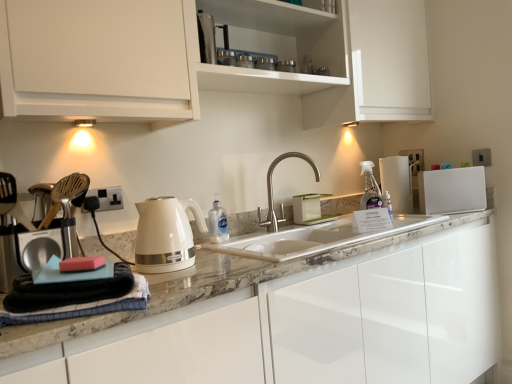
This screenshot has height=384, width=512. Describe the element at coordinates (452, 190) in the screenshot. I see `white glossy refrigerator at right` at that location.

Image resolution: width=512 pixels, height=384 pixels. Describe the element at coordinates (316, 238) in the screenshot. I see `white marble sink at center` at that location.

Image resolution: width=512 pixels, height=384 pixels. I want to click on white glossy electric kettle at center-left, so click(x=166, y=234).

The width and height of the screenshot is (512, 384). I want to click on white glossy refrigerator at right, so click(452, 190).

From the image's perspective, which object appears higher, white plastic electric outlet at upper right, placed as the first electric outlet when sorted from top to bottom, or glossy white cabinet at center, the 2th cabinetry in the top-to-bottom sequence?

From the image's view, white plastic electric outlet at upper right, placed as the first electric outlet when sorted from top to bottom, is above.

Between white plastic electric outlet at upper right, the 2th electric outlet when ordered from bottom to top, and glossy white cabinet at center, the 2th cabinetry in the top-to-bottom sequence, which one has less height?

Standing shorter between the two is white plastic electric outlet at upper right, the 2th electric outlet when ordered from bottom to top.

Considering the relative positions of white plastic electric outlet at upper right, the 2th electric outlet when ordered from bottom to top, and glossy white cabinet at center, the 2th cabinetry in the top-to-bottom sequence, in the image provided, is white plastic electric outlet at upper right, the 2th electric outlet when ordered from bottom to top, to the left of glossy white cabinet at center, the 2th cabinetry in the top-to-bottom sequence, from the viewer's perspective?

In fact, white plastic electric outlet at upper right, the 2th electric outlet when ordered from bottom to top, is to the right of glossy white cabinet at center, the 2th cabinetry in the top-to-bottom sequence.

Looking at this image, considering the relative sizes of white marble sink at center and black plastic electrical outlet at left, the 2th electric outlet from the top, in the image provided, is white marble sink at center thinner than black plastic electrical outlet at left, the 2th electric outlet from the top,?

No.

Based on the photo, considering the relative sizes of white marble sink at center and black plastic electrical outlet at left, the 1th electric outlet positioned from the front, in the image provided, is white marble sink at center shorter than black plastic electrical outlet at left, the 1th electric outlet positioned from the front,?

No.

How different are the orientations of white marble sink at center and black plastic electrical outlet at left, placed as the 2th electric outlet when sorted from back to front, in degrees?

The angle between the facing direction of white marble sink at center and the facing direction of black plastic electrical outlet at left, placed as the 2th electric outlet when sorted from back to front, is 1.19 degrees.

Considering the positions of point (358, 242) and point (120, 190), is point (358, 242) closer or farther from the camera than point (120, 190)?

Point (358, 242).

Identify the location of home appliance on the left of white marble sink at center. (166, 234).

Is white marble sink at center taller than white glossy electric kettle at center-left?

In fact, white marble sink at center may be shorter than white glossy electric kettle at center-left.

Can you tell me how much white marble sink at center and white glossy electric kettle at center-left differ in facing direction?

7.94 degrees separate the facing orientations of white marble sink at center and white glossy electric kettle at center-left.

From the image's perspective, is white marble sink at center above white glossy electric kettle at center-left?

No.

Is white glossy refrigerator at right oriented away from white plastic electric outlet at upper right, which appears as the 1th electric outlet when viewed from the back?

No, white plastic electric outlet at upper right, which appears as the 1th electric outlet when viewed from the back, is not at the back of white glossy refrigerator at right.

Which is in front, point (434, 176) or point (484, 153)?

Positioned in front is point (434, 176).

Who is bigger, white glossy refrigerator at right or white plastic electric outlet at upper right, positioned as the first electric outlet in right-to-left order?

Bigger between the two is white glossy refrigerator at right.

From the image's perspective, who appears lower, black plastic electrical outlet at left, marked as the 1th electric outlet in a left-to-right arrangement, or white glossy cabinet at upper center, the 2th cabinetry positioned from the bottom?

From the image's view, black plastic electrical outlet at left, marked as the 1th electric outlet in a left-to-right arrangement, is below.

Which of these two, black plastic electrical outlet at left, which ranks as the second electric outlet in right-to-left order, or white glossy cabinet at upper center, the 2th cabinetry positioned from the bottom, is bigger?

white glossy cabinet at upper center, the 2th cabinetry positioned from the bottom, is bigger.

Does black plastic electrical outlet at left, which is the 1th electric outlet from bottom to top, have a lesser width compared to white glossy cabinet at upper center, arranged as the 1th cabinetry when viewed from the top?

Indeed, black plastic electrical outlet at left, which is the 1th electric outlet from bottom to top, has a lesser width compared to white glossy cabinet at upper center, arranged as the 1th cabinetry when viewed from the top.

Considering the positions of objects black plastic electrical outlet at left, which ranks as the second electric outlet in right-to-left order, and white glossy cabinet at upper center, arranged as the 1th cabinetry when viewed from the top, in the image provided, who is more to the right, black plastic electrical outlet at left, which ranks as the second electric outlet in right-to-left order, or white glossy cabinet at upper center, arranged as the 1th cabinetry when viewed from the top,?

From the viewer's perspective, white glossy cabinet at upper center, arranged as the 1th cabinetry when viewed from the top, appears more on the right side.

Is point (445, 183) in front of point (228, 243)?

No, (445, 183) is further to viewer.

In the scene shown: Is white glossy refrigerator at right further to camera compared to white marble sink at center?

Yes, white glossy refrigerator at right is behind white marble sink at center.

Would you say white marble sink at center is part of white glossy refrigerator at right's contents?

No, white glossy refrigerator at right does not contain white marble sink at center.

Is white glossy refrigerator at right wider than white marble sink at center?

In fact, white glossy refrigerator at right might be narrower than white marble sink at center.

From the image's perspective, between satin nickel faucet at center and white glossy refrigerator at right, who is located below?

satin nickel faucet at center.

Between point (276, 220) and point (446, 170), which one is positioned behind?

The point (276, 220) is farther from the camera.

How distant is satin nickel faucet at center from white glossy refrigerator at right?

satin nickel faucet at center is 25.78 inches from white glossy refrigerator at right.

Based on the photo, is satin nickel faucet at center outside of white glossy refrigerator at right?

Yes, satin nickel faucet at center is located beyond the bounds of white glossy refrigerator at right.

What are the coordinates of `electric outlet that is the 2nd object located above the glossy white cabinet at center, the 1th cabinetry in the bottom-to-top sequence (from the image's perspective)` in the screenshot? It's located at (481, 157).

You are a GUI agent. You are given a task and a screenshot of the screen. Output one action in this format:
    pyautogui.click(x=<x>, y=<y>)
    Task: Click on the 1st electric outlet behind the white marble sink at center
    
    Given the screenshot: What is the action you would take?
    pyautogui.click(x=108, y=198)

From the image, which object appears to be nearer to white glossy electric kettle at center-left, white glossy cabinet at upper center, arranged as the 1th cabinetry when viewed from the top, or glossy white cabinet at center, the 2th cabinetry in the top-to-bottom sequence?

glossy white cabinet at center, the 2th cabinetry in the top-to-bottom sequence, lies closer to white glossy electric kettle at center-left than the other object.

Consider the image. When comparing their distances from white glossy electric kettle at center-left, does white glossy cabinet at upper center, arranged as the 1th cabinetry when viewed from the top, or satin nickel faucet at center seem closer?

white glossy cabinet at upper center, arranged as the 1th cabinetry when viewed from the top, is closer to white glossy electric kettle at center-left.

Based on their spatial positions, is white marble sink at center or white glossy electric kettle at center-left closer to satin nickel faucet at center?

white marble sink at center lies closer to satin nickel faucet at center than the other object.

Looking at the image, which one is located closer to black plastic electrical outlet at left, the 2th electric outlet from the top, white plastic electric outlet at upper right, the 2th electric outlet when ordered from bottom to top, or white marble sink at center?

The object closer to black plastic electrical outlet at left, the 2th electric outlet from the top, is white marble sink at center.

Estimate the real-world distances between objects in this image. Which object is closer to glossy white cabinet at center, the 2th cabinetry in the top-to-bottom sequence, black plastic electrical outlet at left, marked as the 1th electric outlet in a left-to-right arrangement, or white glossy refrigerator at right?

white glossy refrigerator at right is closer to glossy white cabinet at center, the 2th cabinetry in the top-to-bottom sequence.

Based on their spatial positions, is white plastic electric outlet at upper right, the 2th electric outlet when ordered from bottom to top, or white glossy refrigerator at right further from glossy white cabinet at center, the 1th cabinetry in the bottom-to-top sequence?

white plastic electric outlet at upper right, the 2th electric outlet when ordered from bottom to top.

Looking at the image, which one is located further to white glossy electric kettle at center-left, glossy white cabinet at center, the 1th cabinetry in the bottom-to-top sequence, or white glossy refrigerator at right?

Among the two, white glossy refrigerator at right is located further to white glossy electric kettle at center-left.

When comparing their distances from white marble sink at center, does black plastic electrical outlet at left, placed as the 2th electric outlet when sorted from back to front, or white glossy refrigerator at right seem closer?

white glossy refrigerator at right.

Find the location of a particular element. The height and width of the screenshot is (384, 512). sink located between black plastic electrical outlet at left, the 1th electric outlet positioned from the front, and white glossy refrigerator at right in the left-right direction is located at coordinates (316, 238).

Identify the location of sink between white glossy cabinet at upper center, arranged as the 1th cabinetry when viewed from the top, and glossy white cabinet at center, the 1th cabinetry in the bottom-to-top sequence, in the vertical direction. The image size is (512, 384). (316, 238).

Where is `sink between white glossy electric kettle at center-left and white plastic electric outlet at upper right, positioned as the first electric outlet in right-to-left order, in the horizontal direction`? This screenshot has width=512, height=384. sink between white glossy electric kettle at center-left and white plastic electric outlet at upper right, positioned as the first electric outlet in right-to-left order, in the horizontal direction is located at coordinates (316, 238).

Find the location of a particular element. home appliance located between glossy white cabinet at center, the 2th cabinetry in the top-to-bottom sequence, and white glossy refrigerator at right in the depth direction is located at coordinates (166, 234).